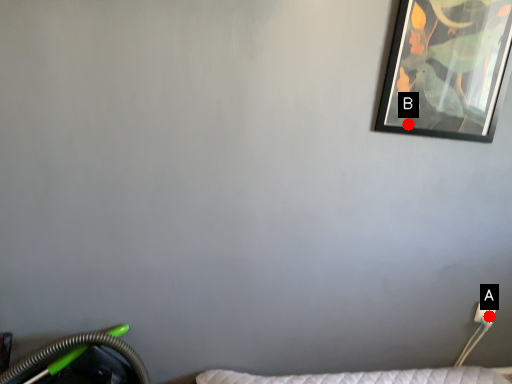
Question: Two points are circled on the image, labeled by A and B beside each circle. Which of the following is the closest to the observer?

Choices:
 (A) A is closer
 (B) B is closer

Answer: (B)